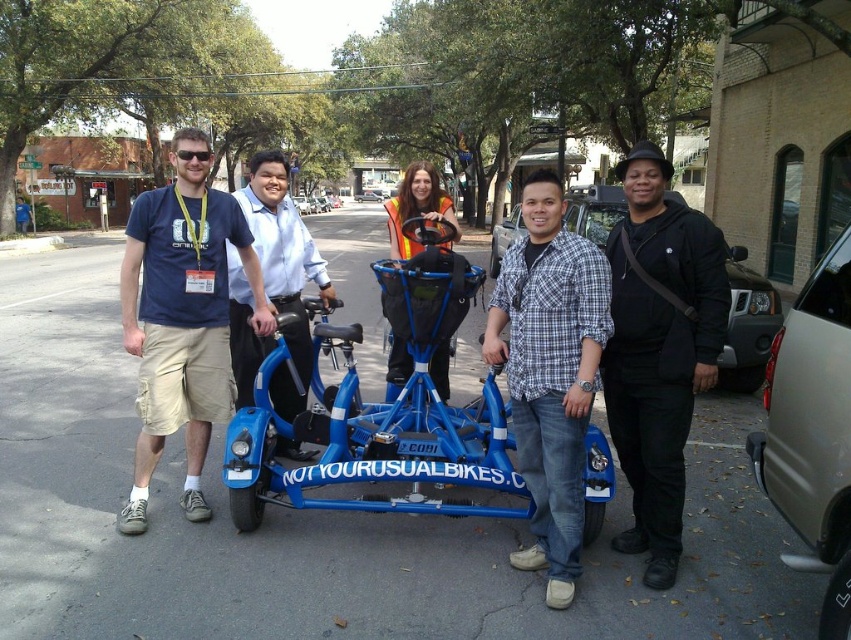
Question: Which object is the closest to the blue matte tricycle at center?

Choices:
 (A) plaid shirt at center
 (B) black matte jacket at center
 (C) matte blue shorts at left
 (D) metallic gray sedan at lower right

Answer: (A)

Question: Which object is the closest to the blue matte bicycle at center?

Choices:
 (A) matte blue shorts at left
 (B) plaid shirt at center
 (C) metallic silver car at center

Answer: (A)

Question: Among these objects, which one is nearest to the camera?

Choices:
 (A) black matte jacket at center
 (B) metallic silver car at center

Answer: (A)

Question: In this image, where is black matte jacket at center located relative to black matte car at right?

Choices:
 (A) right
 (B) left

Answer: (B)

Question: In this image, where is blue matte bicycle at center located relative to metallic silver car at center?

Choices:
 (A) above
 (B) below

Answer: (B)

Question: Can you confirm if black matte jacket at center is smaller than plaid shirt at center?

Choices:
 (A) yes
 (B) no

Answer: (B)